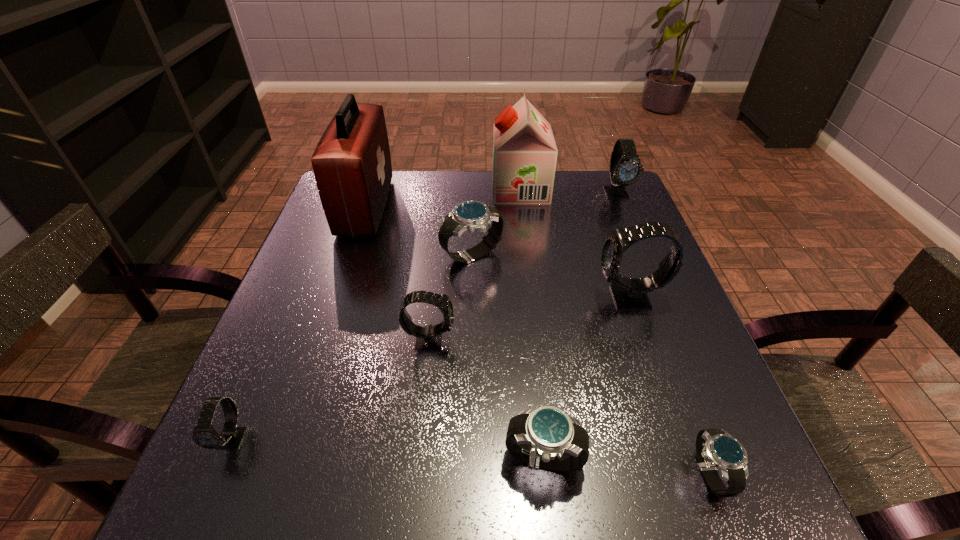
Identify the location of red first aid kit. (352, 166).

This screenshot has width=960, height=540. Identify the location of the first aid kit. (352, 166).

Image resolution: width=960 pixels, height=540 pixels. In order to click on soya milk in this screenshot , I will do `click(524, 150)`.

Image resolution: width=960 pixels, height=540 pixels. I want to click on the biggest gray watch, so click(629, 293).

At what (x,y) coordinates should I click in order to perform the action: click on the tallest watch. Please return your answer as a coordinate pair (x, y). The width and height of the screenshot is (960, 540). Looking at the image, I should click on (629, 293).

Where is `the farthest gray watch`? The width and height of the screenshot is (960, 540). the farthest gray watch is located at coordinates (625, 169).

The image size is (960, 540). I want to click on the second biggest gray watch, so click(625, 169).

Image resolution: width=960 pixels, height=540 pixels. What are the coordinates of `the biggest silver watch` in the screenshot? It's located at (471, 215).

Where is `the sixth nearest watch`? The height and width of the screenshot is (540, 960). the sixth nearest watch is located at coordinates (471, 215).

Identify the location of the second smallest gray watch. (428, 337).